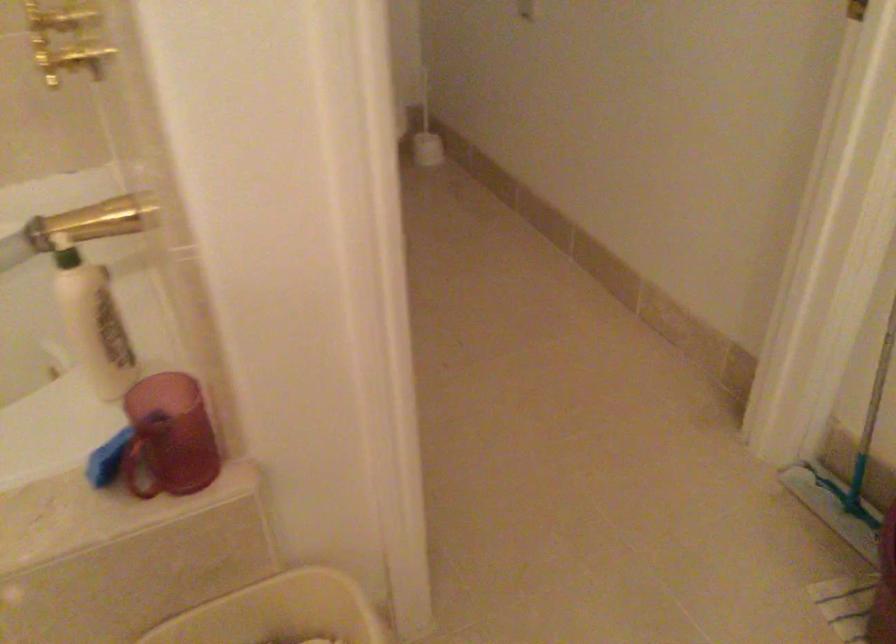
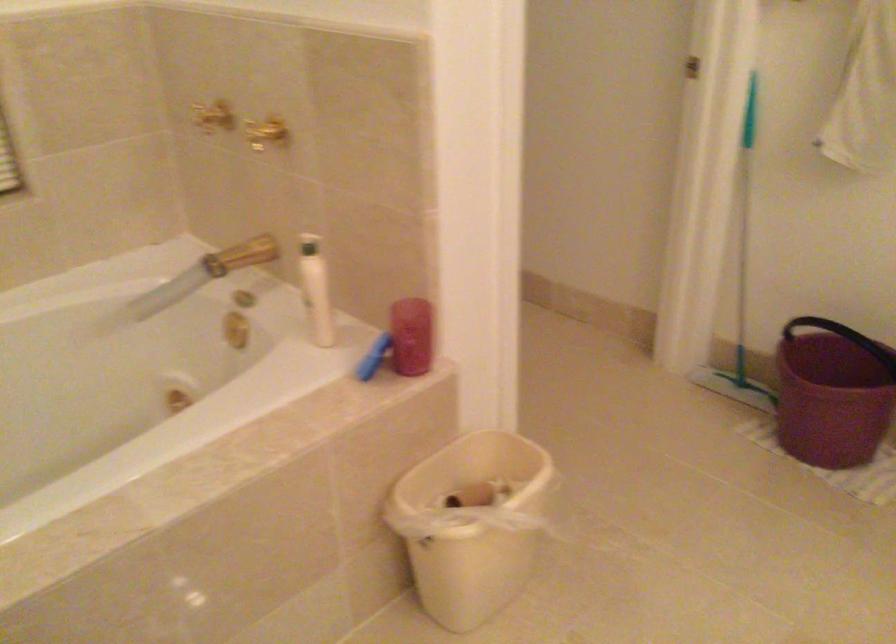
Question: I am providing you with two images of the same scene from different viewpoints. Please identify which objects are invisible in image2.

Choices:
 (A) gold faucet handle
 (B) dark dropper bottle
 (C) red plastic cup
 (D) bottle pump dispenser

Answer: (D)